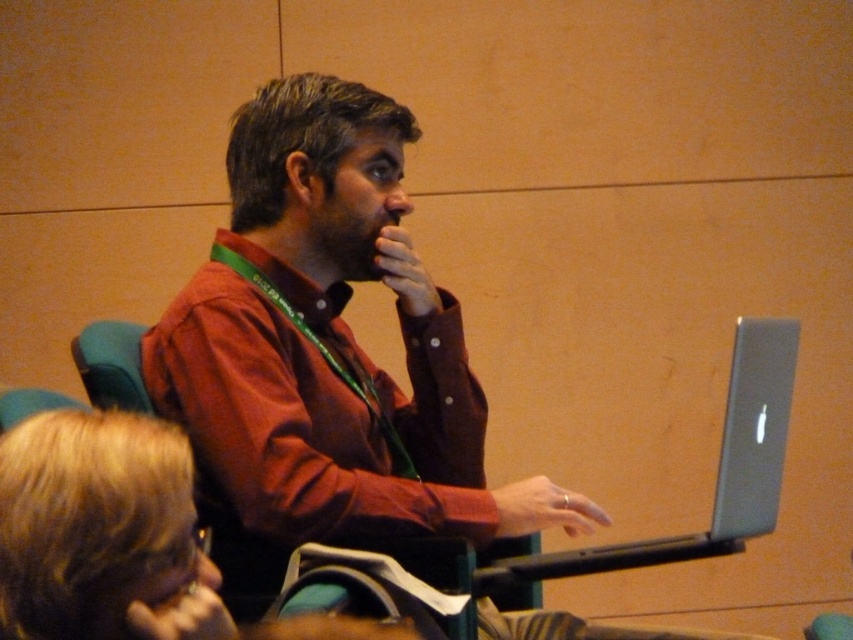
Question: Which is farther from the blonde hair at upper left?

Choices:
 (A) matte red shirt at center
 (B) blue fabric chair at left
 (C) silver metallic laptop at right

Answer: (C)

Question: Does matte red shirt at center appear on the left side of blonde hair at upper left?

Choices:
 (A) yes
 (B) no

Answer: (B)

Question: Does matte red shirt at center have a greater width compared to silver metallic laptop at right?

Choices:
 (A) yes
 (B) no

Answer: (A)

Question: Is silver metallic laptop at right further to the viewer compared to blue fabric chair at left?

Choices:
 (A) no
 (B) yes

Answer: (A)

Question: Which point is closer to the camera?

Choices:
 (A) silver metallic laptop at right
 (B) matte red shirt at center
 (C) blue fabric chair at left

Answer: (B)

Question: Which point is farther to the camera?

Choices:
 (A) (453, 356)
 (B) (4, 513)
 (C) (90, 356)

Answer: (A)